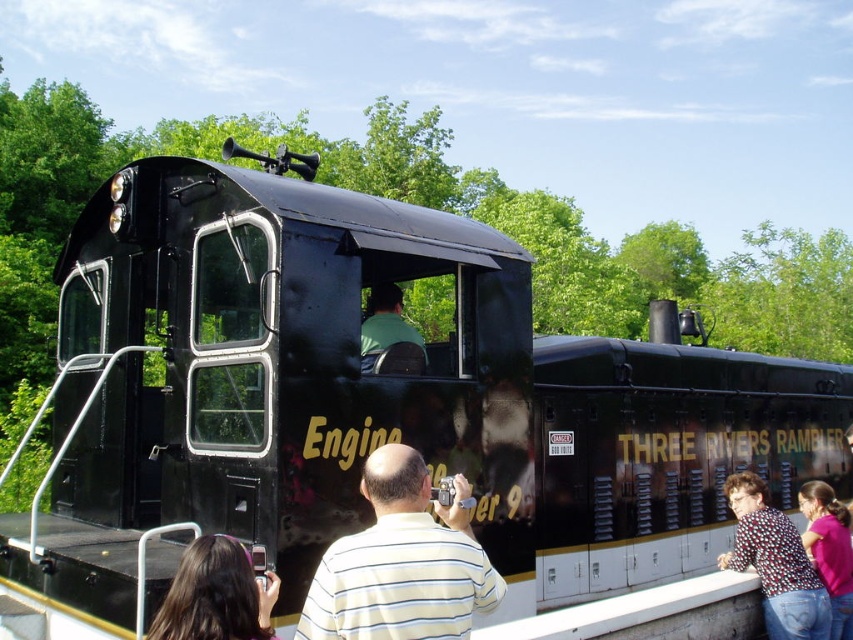
Between striped cotton shirt at center and dark brown hair at lower left, which one is positioned lower?

Positioned lower is dark brown hair at lower left.

Which is behind, point (376, 451) or point (224, 554)?

The point (376, 451) is more distant.

Between point (448, 515) and point (199, 561), which one is positioned behind?

The point (448, 515) is behind.

Locate an element on the screen. striped cotton shirt at center is located at coordinates (402, 563).

Does printed fabric blouse at lower right have a lesser width compared to dark brown hair at lower left?

No.

Which is more to the right, printed fabric blouse at lower right or dark brown hair at lower left?

From the viewer's perspective, printed fabric blouse at lower right appears more on the right side.

Is point (773, 602) positioned before point (178, 616)?

No, (773, 602) is further to viewer.

I want to click on printed fabric blouse at lower right, so click(775, 563).

Is point (167, 618) positioned in front of point (846, 516)?

Yes, it is.

Between point (199, 625) and point (831, 604), which one is positioned in front?

Point (199, 625) is in front.

Describe the element at coordinates (215, 595) in the screenshot. The height and width of the screenshot is (640, 853). I see `dark brown hair at lower left` at that location.

Image resolution: width=853 pixels, height=640 pixels. In order to click on dark brown hair at lower left in this screenshot , I will do `click(215, 595)`.